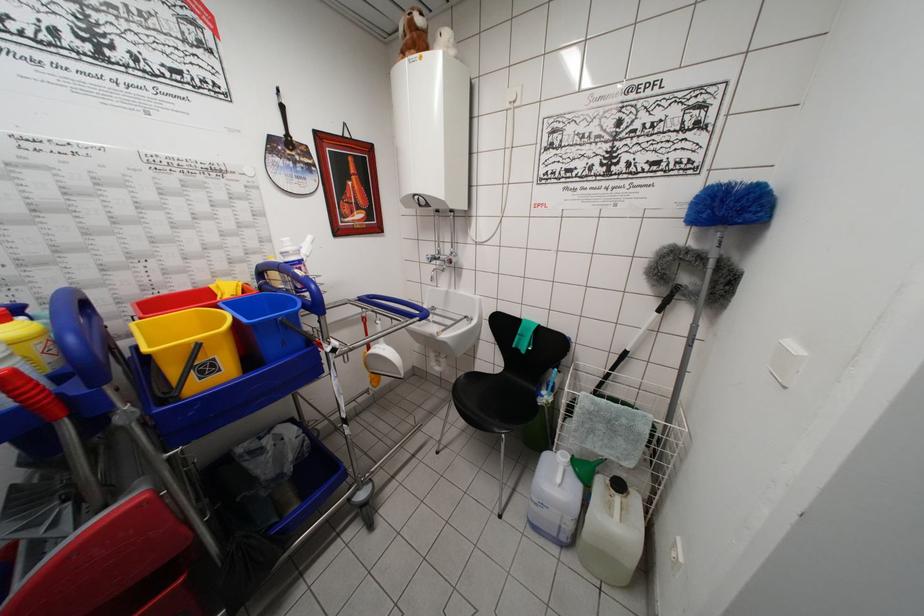
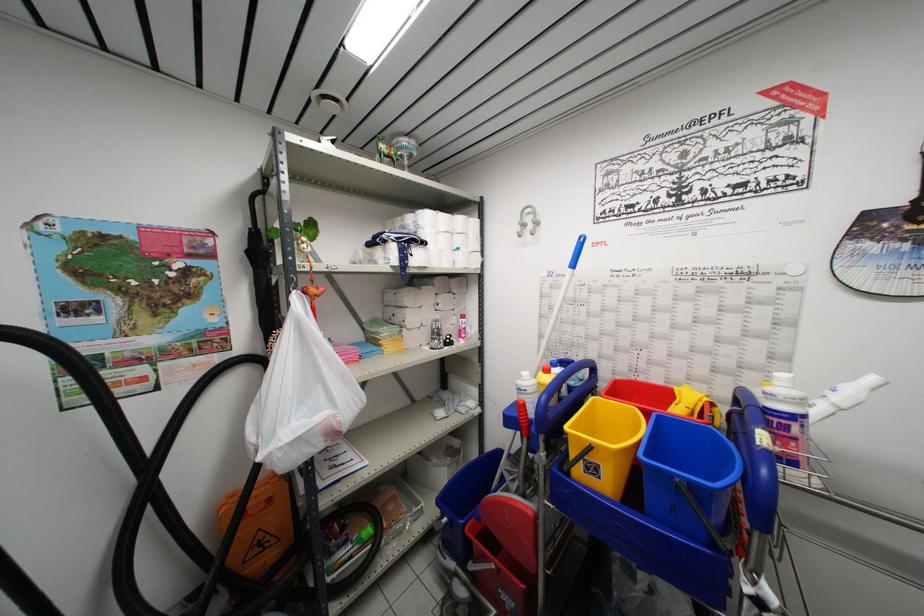
Question: The camera is either moving clockwise (left) or counter-clockwise (right) around the object. The first image is from the beginning of the video and the second image is from the end. Is the camera moving left or right when shooting the video?

Choices:
 (A) Left
 (B) Right

Answer: (B)